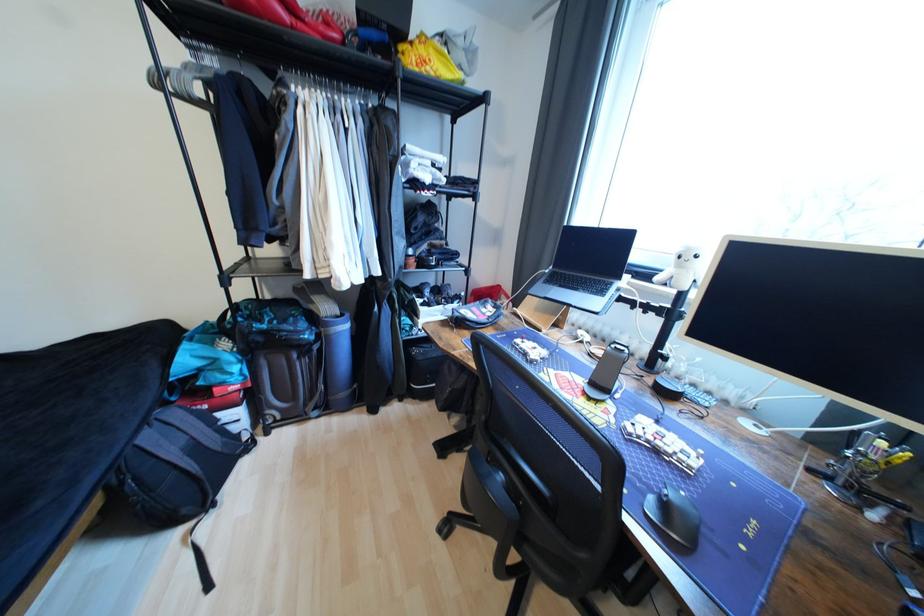
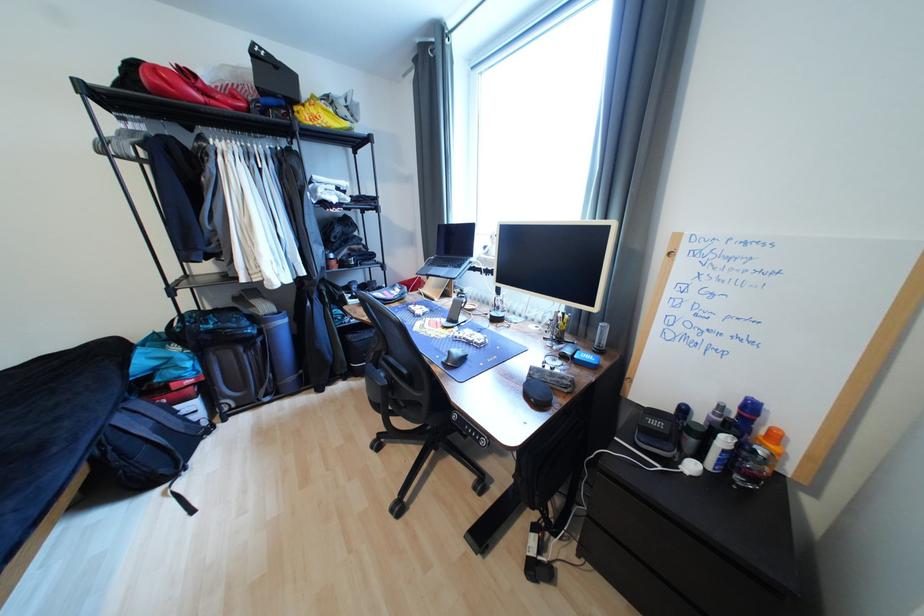
Question: The camera is either moving clockwise (left) or counter-clockwise (right) around the object. The first image is from the beginning of the video and the second image is from the end. Is the camera moving left or right when shooting the video?

Choices:
 (A) Left
 (B) Right

Answer: (A)